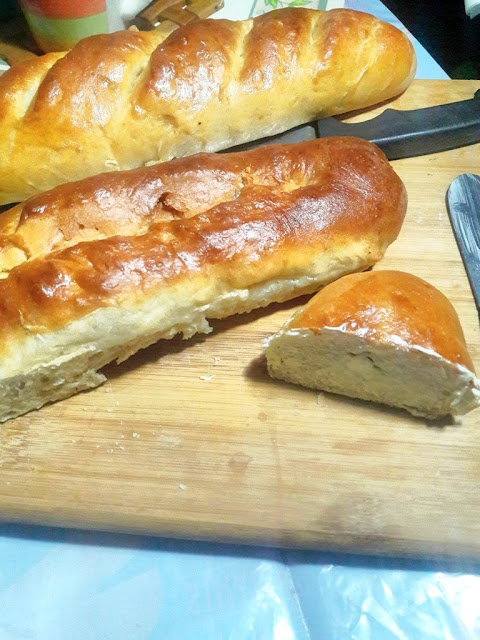
Find the location of a particular element. This screenshot has width=480, height=640. shadow of chopping board is located at coordinates (159, 547).